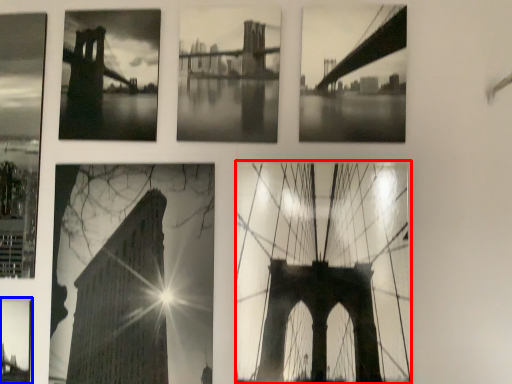
Question: Which point is further to the camera, picture frame (highlighted by a red box) or picture frame (highlighted by a blue box)?

Choices:
 (A) picture frame
 (B) picture frame

Answer: (B)